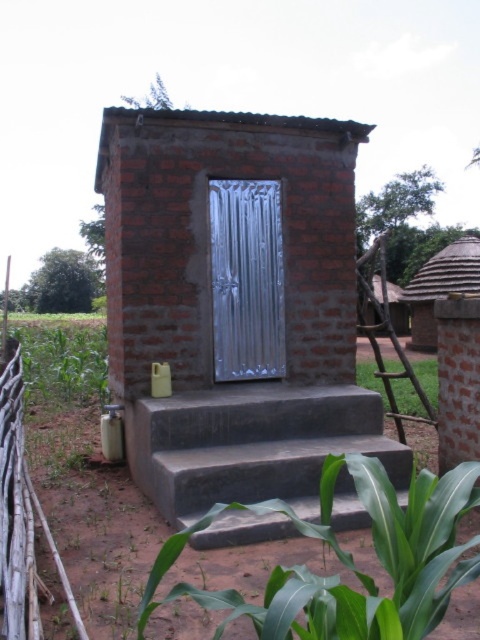
Does metallic silver door at center have a lesser height compared to green leafy plant at right?

No, metallic silver door at center is not shorter than green leafy plant at right.

Who is more distant from viewer, (217, 189) or (411, 390)?

The point (411, 390) is more distant.

Which is behind, point (223, 211) or point (403, 388)?

The point (403, 388) is more distant.

I want to click on metallic silver door at center, so click(247, 280).

Is green leafy plant at lower center bigger than metallic silver door at center?

Yes.

Is the position of green leafy plant at lower center more distant than that of metallic silver door at center?

No, it is in front of metallic silver door at center.

Locate an element on the screen. green leafy plant at lower center is located at coordinates (350, 561).

Consider the image. Is brick wall at center behind smooth concrete stairs at center?

Yes, brick wall at center is further from the viewer.

Is brick wall at center thinner than smooth concrete stairs at center?

No.

The image size is (480, 640). Identify the location of brick wall at center. (216, 310).

This screenshot has height=640, width=480. Find the location of `brick wall at center`. brick wall at center is located at coordinates (216, 310).